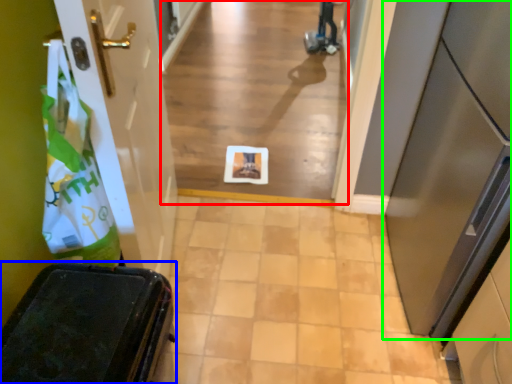
Question: Which object is the farthest from alley (highlighted by a red box)? Choose among these: furniture (highlighted by a blue box) or door (highlighted by a green box).

Choices:
 (A) furniture
 (B) door

Answer: (A)